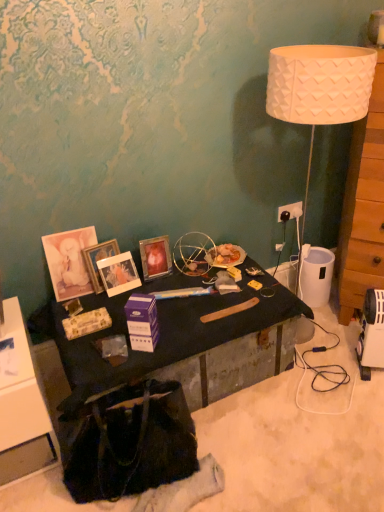
Question: Considering the relative sizes of black matte desk at center and matte black cabinet at lower left in the image provided, is black matte desk at center thinner than matte black cabinet at lower left?

Choices:
 (A) no
 (B) yes

Answer: (A)

Question: Can you confirm if black matte desk at center is positioned to the right of matte black cabinet at lower left?

Choices:
 (A) yes
 (B) no

Answer: (A)

Question: Does black matte desk at center touch matte black cabinet at lower left?

Choices:
 (A) yes
 (B) no

Answer: (B)

Question: From a real-world perspective, is black matte desk at center on top of matte black cabinet at lower left?

Choices:
 (A) yes
 (B) no

Answer: (A)

Question: Does black matte desk at center have a smaller size compared to matte black cabinet at lower left?

Choices:
 (A) yes
 (B) no

Answer: (B)

Question: Does black matte desk at center turn towards matte black cabinet at lower left?

Choices:
 (A) yes
 (B) no

Answer: (B)

Question: Can you confirm if black matte desk at center is taller than matte wooden picture frame at center left, the third picture frame in the right-to-left sequence?

Choices:
 (A) no
 (B) yes

Answer: (A)

Question: From the image's perspective, would you say black matte desk at center is positioned over matte wooden picture frame at center left, the third picture frame in the right-to-left sequence?

Choices:
 (A) no
 (B) yes

Answer: (A)

Question: Can you confirm if black matte desk at center is positioned to the right of matte wooden picture frame at center left, positioned as the 1th picture frame in left-to-right order?

Choices:
 (A) no
 (B) yes

Answer: (B)

Question: Could you tell me if black matte desk at center is turned towards matte wooden picture frame at center left, the third picture frame in the right-to-left sequence?

Choices:
 (A) no
 (B) yes

Answer: (A)

Question: Does black matte desk at center have a smaller size compared to matte wooden picture frame at center left, the third picture frame in the right-to-left sequence?

Choices:
 (A) no
 (B) yes

Answer: (A)

Question: Would you say matte wooden picture frame at center left, positioned as the 1th picture frame in left-to-right order, is part of black matte desk at center's contents?

Choices:
 (A) yes
 (B) no

Answer: (B)

Question: From a real-world perspective, is matte black cabinet at lower left positioned over black fabric handbag at lower left based on gravity?

Choices:
 (A) yes
 (B) no

Answer: (A)